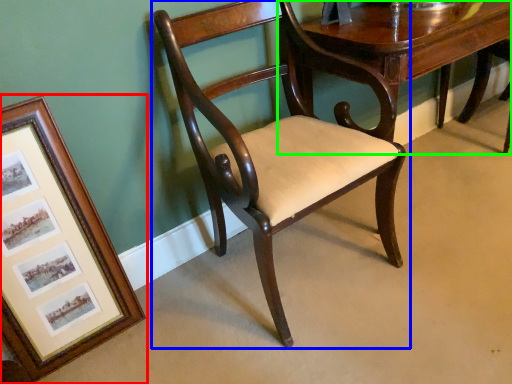
Question: Considering the real-world distances, which object is closest to picture frame (highlighted by a red box)? chair (highlighted by a blue box) or table (highlighted by a green box).

Choices:
 (A) chair
 (B) table

Answer: (A)